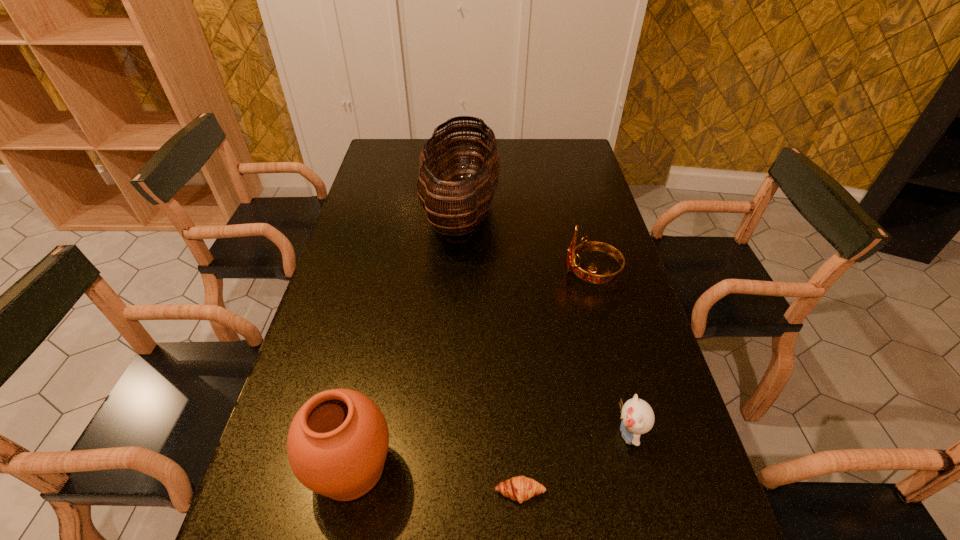
Image resolution: width=960 pixels, height=540 pixels. Identify the location of vacant space at the far right corner of the desktop. click(x=558, y=163).

This screenshot has width=960, height=540. I want to click on free space between the urn and the third tallest object, so click(471, 370).

Identify the location of vacant region between the kitten and the urn. Image resolution: width=960 pixels, height=540 pixels. (490, 451).

This screenshot has width=960, height=540. What are the coordinates of `vacant point located between the tiara and the basket` in the screenshot? It's located at (526, 242).

This screenshot has width=960, height=540. I want to click on free space that is in between the basket and the shortest object, so click(491, 352).

You are a GUI agent. You are given a task and a screenshot of the screen. Output one action in this format:
    pyautogui.click(x=<x>, y=<y>)
    Task: Click on the free space that is in between the basket and the tiara
    This screenshot has height=540, width=960.
    Given the screenshot: What is the action you would take?
    pyautogui.click(x=526, y=242)

At what (x,y) coordinates should I click in order to perform the action: click on free space between the urn and the pastry. Please return your answer as a coordinate pair (x, y). Image resolution: width=960 pixels, height=540 pixels. Looking at the image, I should click on (436, 480).

This screenshot has width=960, height=540. Identify the location of free space between the third shortest object and the kitten. (610, 354).

Where is `vacant space in between the kitten and the urn`? vacant space in between the kitten and the urn is located at coordinates (490, 451).

This screenshot has width=960, height=540. In order to click on vacant space that is in between the shortest object and the kitten in this screenshot , I will do `click(574, 463)`.